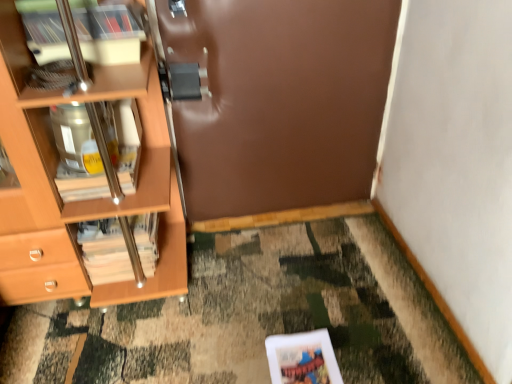
Question: Considering the relative sizes of wooden cabinet at left and brown matte door at center in the image provided, is wooden cabinet at left bigger than brown matte door at center?

Choices:
 (A) no
 (B) yes

Answer: (A)

Question: Considering the relative sizes of wooden cabinet at left and brown matte door at center in the image provided, is wooden cabinet at left taller than brown matte door at center?

Choices:
 (A) yes
 (B) no

Answer: (B)

Question: Is wooden cabinet at left wider than brown matte door at center?

Choices:
 (A) no
 (B) yes

Answer: (B)

Question: From a real-world perspective, is wooden cabinet at left positioned over brown matte door at center based on gravity?

Choices:
 (A) yes
 (B) no

Answer: (A)

Question: From the image's perspective, is wooden cabinet at left on top of brown matte door at center?

Choices:
 (A) no
 (B) yes

Answer: (A)

Question: Does wooden cabinet at left appear on the right side of brown matte door at center?

Choices:
 (A) no
 (B) yes

Answer: (A)

Question: Is brown matte door at center in front of wooden cabinet at left?

Choices:
 (A) no
 (B) yes

Answer: (A)

Question: Would you consider brown matte door at center to be distant from wooden cabinet at left?

Choices:
 (A) no
 (B) yes

Answer: (A)

Question: Considering the relative sizes of brown matte door at center and wooden cabinet at left in the image provided, is brown matte door at center taller than wooden cabinet at left?

Choices:
 (A) no
 (B) yes

Answer: (B)

Question: Is brown matte door at center at the left side of wooden cabinet at left?

Choices:
 (A) no
 (B) yes

Answer: (A)

Question: Is brown matte door at center oriented towards wooden cabinet at left?

Choices:
 (A) no
 (B) yes

Answer: (A)

Question: Can you confirm if brown matte door at center is bigger than wooden cabinet at left?

Choices:
 (A) no
 (B) yes

Answer: (B)

Question: Is wooden/matte magazine at left thinner than brown matte door at center?

Choices:
 (A) no
 (B) yes

Answer: (A)